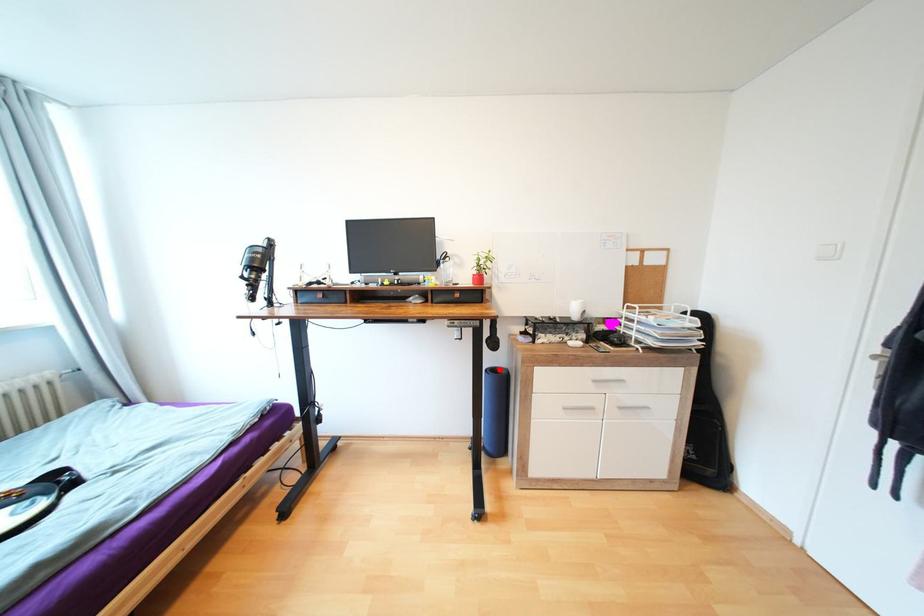
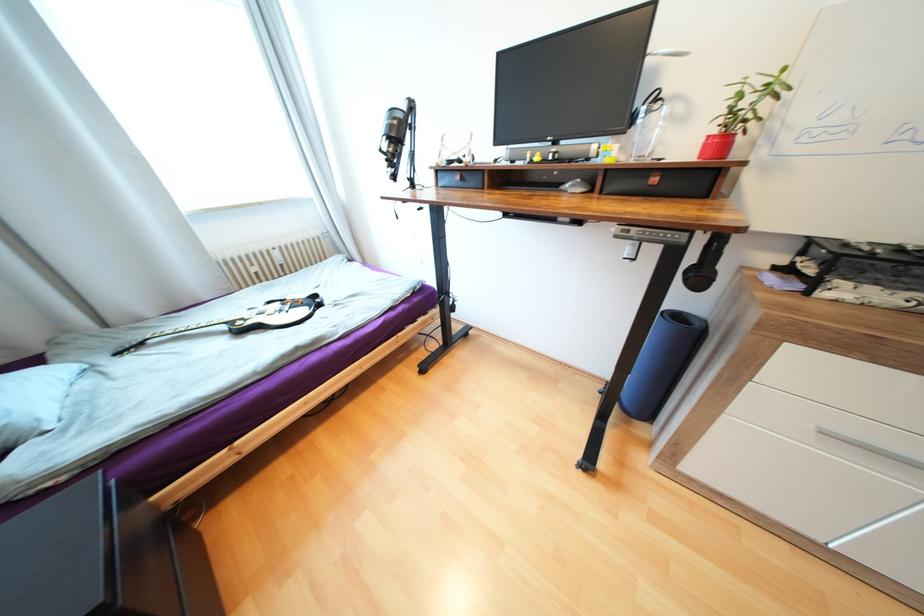
Locate, in the second image, the point that corresponds to the highlighted location in the first image.

(685, 315)